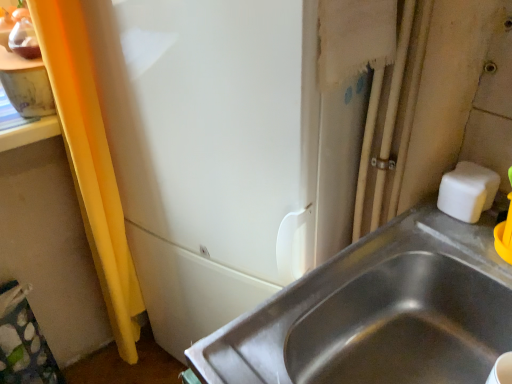
What do you see at coordinates (467, 191) in the screenshot? I see `white matte soap at upper right` at bounding box center [467, 191].

Find the location of a particular element. This screenshot has width=512, height=384. white matte soap at upper right is located at coordinates (467, 191).

Measure the distance between point (447,183) and camera.

The distance of point (447,183) from camera is 76.00 centimeters.

Measure the distance between white matte soap at upper right and camera.

They are 71.07 centimeters apart.

What do you see at coordinates (378, 313) in the screenshot?
I see `stainless steel sink at lower right` at bounding box center [378, 313].

Locate an element on the screen. This screenshot has width=512, height=384. stainless steel sink at lower right is located at coordinates (378, 313).

What is the approximate height of stainless steel sink at lower right?

The height of stainless steel sink at lower right is 34.41 centimeters.

At what (x,y) coordinates should I click in order to perform the action: click on white matte soap at upper right. Please return your answer as a coordinate pair (x, y). Image resolution: width=512 pixels, height=384 pixels. Looking at the image, I should click on (467, 191).

Considering the relative positions of stainless steel sink at lower right and white matte soap at upper right in the image provided, is stainless steel sink at lower right to the left of white matte soap at upper right from the viewer's perspective?

Yes, stainless steel sink at lower right is to the left of white matte soap at upper right.

Based on the photo, considering the positions of objects stainless steel sink at lower right and white matte soap at upper right in the image provided, who is in front, stainless steel sink at lower right or white matte soap at upper right?

stainless steel sink at lower right.

Which is in front, point (447, 216) or point (446, 179)?

Positioned in front is point (447, 216).

From the image's perspective, is stainless steel sink at lower right above or below white matte soap at upper right?

Based on their image positions, stainless steel sink at lower right is located beneath white matte soap at upper right.

From a real-world perspective, is stainless steel sink at lower right over white matte soap at upper right?

No, from a real-world perspective, stainless steel sink at lower right is not on top of white matte soap at upper right.

Considering the sizes of stainless steel sink at lower right and white matte soap at upper right in the image, is stainless steel sink at lower right wider or thinner than white matte soap at upper right?

stainless steel sink at lower right is wider than white matte soap at upper right.

Is stainless steel sink at lower right shorter than white matte soap at upper right?

No.

Between stainless steel sink at lower right and white matte soap at upper right, which one has smaller size?

Smaller between the two is white matte soap at upper right.

Is white matte soap at upper right a part of stainless steel sink at lower right?

No, stainless steel sink at lower right does not contain white matte soap at upper right.

Does stainless steel sink at lower right touch white matte soap at upper right?

They are not placed beside each other.

Is white matte soap at upper right at the back of stainless steel sink at lower right?

That's not correct — stainless steel sink at lower right is not looking away from white matte soap at upper right.

The image size is (512, 384). I want to click on soap above the stainless steel sink at lower right (from a real-world perspective), so click(467, 191).

Does white matte soap at upper right appear on the right side of stainless steel sink at lower right?

Yes.

Consider the image. Which is in front, white matte soap at upper right or stainless steel sink at lower right?

stainless steel sink at lower right is closer to the camera.

Between point (493, 188) and point (406, 240), which one is positioned in front?

The point (406, 240) is in front.

From the image's perspective, would you say white matte soap at upper right is positioned over stainless steel sink at lower right?

Yes.

From a real-world perspective, is white matte soap at upper right beneath stainless steel sink at lower right?

Incorrect, from a real-world perspective, white matte soap at upper right is higher than stainless steel sink at lower right.

Which of these two, white matte soap at upper right or stainless steel sink at lower right, is wider?

stainless steel sink at lower right.

From the picture: Considering the relative sizes of white matte soap at upper right and stainless steel sink at lower right in the image provided, is white matte soap at upper right taller than stainless steel sink at lower right?

No.

Can you confirm if white matte soap at upper right is smaller than stainless steel sink at lower right?

Yes.

Which is correct: white matte soap at upper right is inside stainless steel sink at lower right, or outside of it?

white matte soap at upper right cannot be found inside stainless steel sink at lower right.

Is there a large distance between white matte soap at upper right and stainless steel sink at lower right?

white matte soap at upper right is actually quite close to stainless steel sink at lower right.

Is white matte soap at upper right oriented towards stainless steel sink at lower right?

No, white matte soap at upper right is not facing towards stainless steel sink at lower right.

Can you tell me how much white matte soap at upper right and stainless steel sink at lower right differ in facing direction?

The facing directions of white matte soap at upper right and stainless steel sink at lower right are 3.43 degrees apart.

The image size is (512, 384). I want to click on soap above the stainless steel sink at lower right (from a real-world perspective), so click(x=467, y=191).

Image resolution: width=512 pixels, height=384 pixels. I want to click on sink that is in front of the white matte soap at upper right, so click(x=378, y=313).

Find the location of a particular element. The height and width of the screenshot is (384, 512). sink below the white matte soap at upper right (from a real-world perspective) is located at coordinates (378, 313).